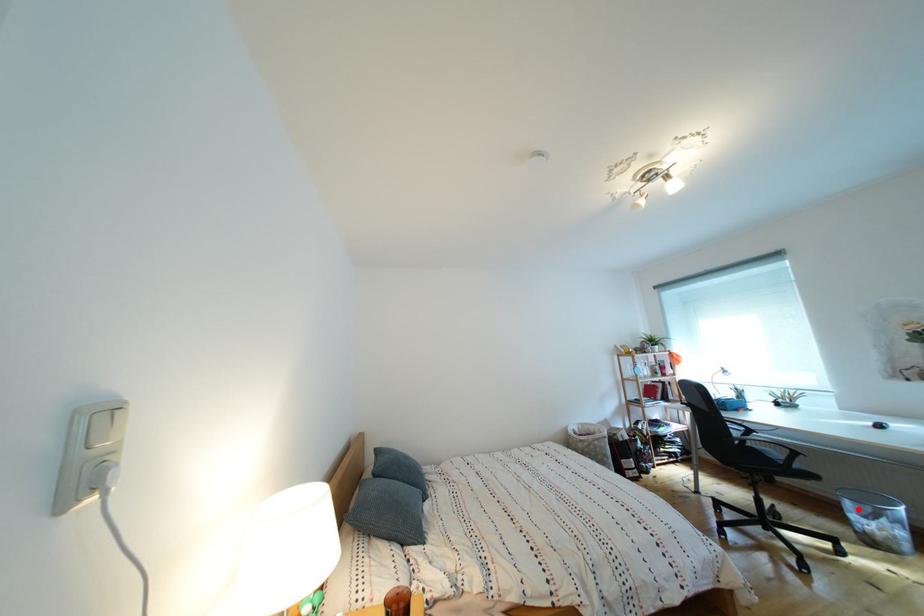
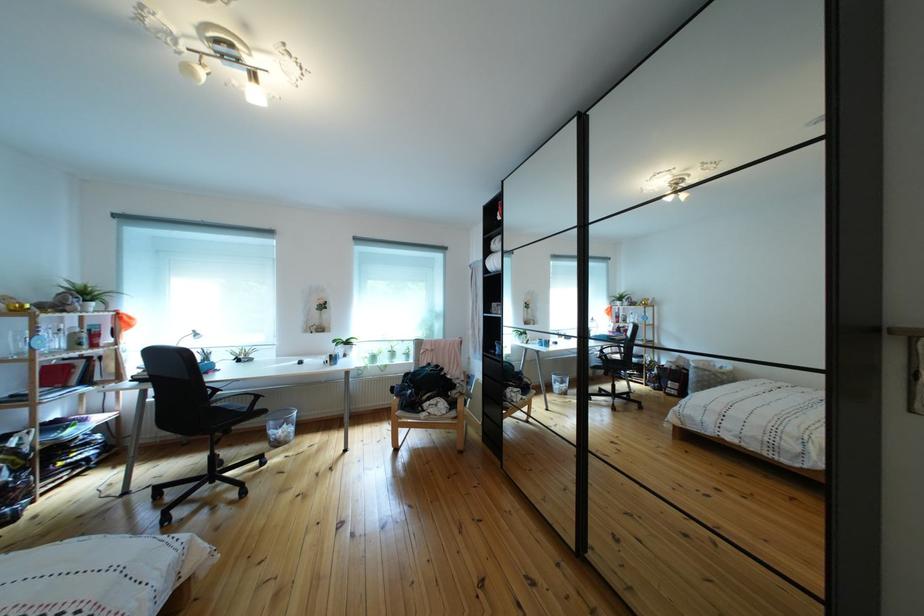
Question: I am providing you with two images of the same scene from different viewpoints. In image1, a red point is highlighted. Considering the same 3D point in image2, which of the following is correct?

Choices:
 (A) It is closer
 (B) It is farther

Answer: (B)